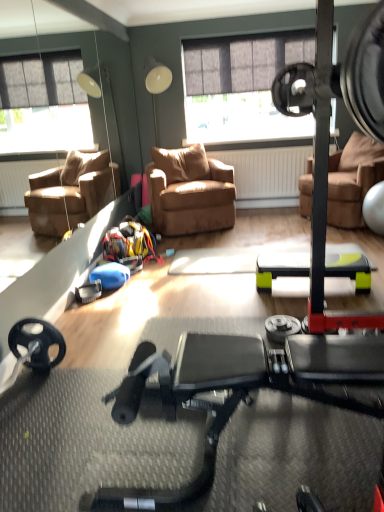
Question: Is brown leather chair at center, which is counted as the 2th chair, starting from the right, oriented towards black rubber stationary bicycle at center?

Choices:
 (A) yes
 (B) no

Answer: (A)

Question: From the image's perspective, is brown leather chair at center, the 1th chair positioned from the left, located above black rubber stationary bicycle at center?

Choices:
 (A) no
 (B) yes

Answer: (B)

Question: Can you confirm if brown leather chair at center, which is counted as the 2th chair, starting from the right, is bigger than black rubber stationary bicycle at center?

Choices:
 (A) no
 (B) yes

Answer: (B)

Question: Does brown leather chair at center, which is counted as the 2th chair, starting from the right, appear on the right side of black rubber stationary bicycle at center?

Choices:
 (A) yes
 (B) no

Answer: (B)

Question: Can we say brown leather chair at center, the 1th chair positioned from the left, lies outside black rubber stationary bicycle at center?

Choices:
 (A) no
 (B) yes

Answer: (B)

Question: Is brown leather chair at center, the 1th chair positioned from the left, in front of or behind black rubber stationary bicycle at center in the image?

Choices:
 (A) behind
 (B) front

Answer: (A)

Question: From their relative heights in the image, would you say brown leather chair at center, the 1th chair positioned from the left, is taller or shorter than black rubber stationary bicycle at center?

Choices:
 (A) tall
 (B) short

Answer: (A)

Question: Is point (218, 168) positioned closer to the camera than point (296, 356)?

Choices:
 (A) farther
 (B) closer

Answer: (A)

Question: Which is correct: brown leather chair at center, which is counted as the 2th chair, starting from the right, is inside black rubber stationary bicycle at center, or outside of it?

Choices:
 (A) inside
 (B) outside

Answer: (B)

Question: Based on their positions, is brown leather chair at center, the second chair from the left, located to the left or right of black rubber stationary bicycle at center?

Choices:
 (A) right
 (B) left

Answer: (A)

Question: Relative to black rubber stationary bicycle at center, is brown leather chair at center, the 1th chair in the right-to-left sequence, in front or behind?

Choices:
 (A) behind
 (B) front

Answer: (A)

Question: Based on their sizes in the image, would you say brown leather chair at center, the 1th chair in the right-to-left sequence, is bigger or smaller than black rubber stationary bicycle at center?

Choices:
 (A) big
 (B) small

Answer: (A)

Question: Is brown leather chair at center, the 1th chair in the right-to-left sequence, wider or thinner than black rubber stationary bicycle at center?

Choices:
 (A) thin
 (B) wide

Answer: (A)

Question: Is point (301, 214) positioned closer to the camera than point (183, 167)?

Choices:
 (A) closer
 (B) farther

Answer: (B)

Question: Is brown leather chair at center, the second chair from the left, spatially inside brown leather chair at center, the 1th chair positioned from the left, or outside of it?

Choices:
 (A) inside
 (B) outside

Answer: (B)